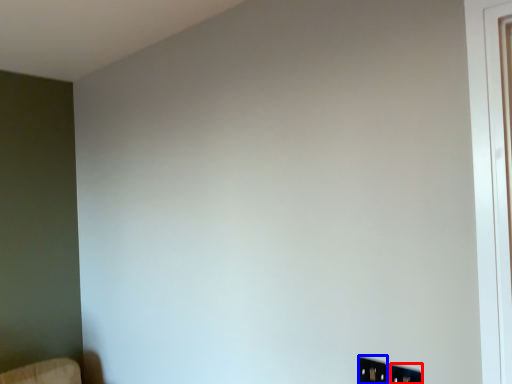
Question: Which object appears closest to the camera in this image, electric outlet (highlighted by a red box) or electric outlet (highlighted by a blue box)?

Choices:
 (A) electric outlet
 (B) electric outlet

Answer: (A)